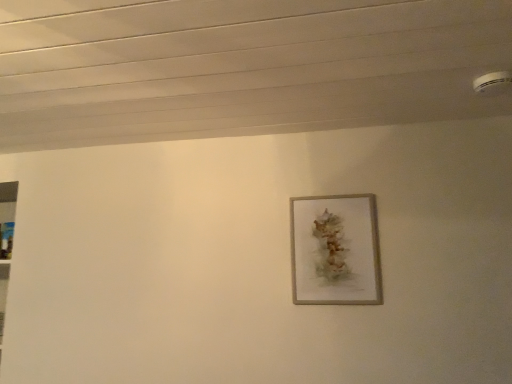
Question: Should I look upward or downward to see matte gray picture frame at center?

Choices:
 (A) up
 (B) down

Answer: (B)